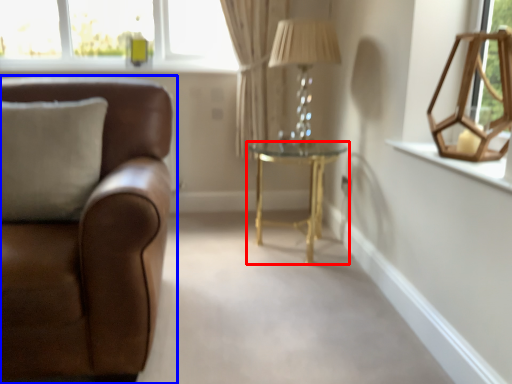
Question: Which object appears farthest to the camera in this image, table (highlighted by a red box) or studio couch (highlighted by a blue box)?

Choices:
 (A) table
 (B) studio couch

Answer: (A)